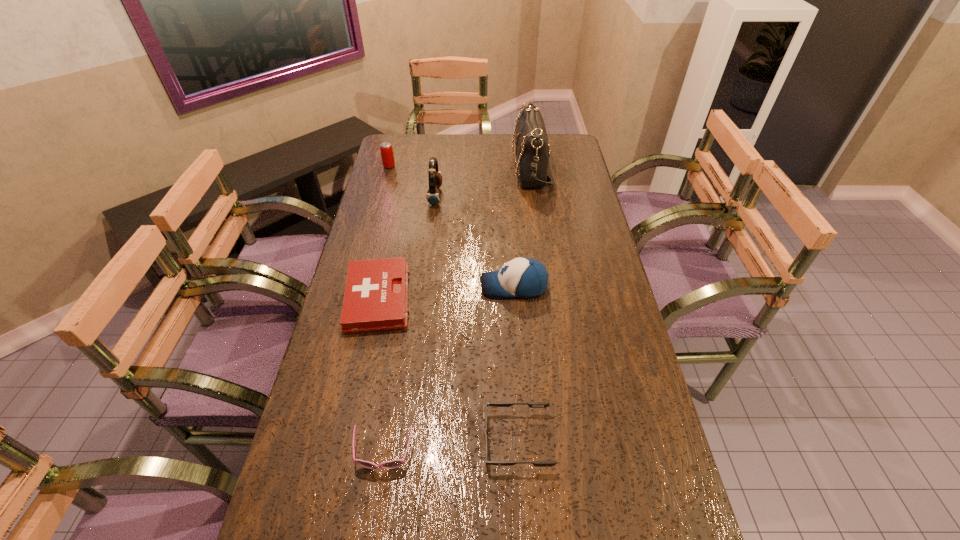
Where is `handbag that is at the far edge`? Image resolution: width=960 pixels, height=540 pixels. handbag that is at the far edge is located at coordinates coord(532,151).

I want to click on beer can that is at the far edge, so click(386, 149).

In order to click on beer can located at the left edge in this screenshot , I will do `click(386, 149)`.

The image size is (960, 540). In order to click on the first-aid kit present at the left edge in this screenshot , I will do `click(376, 293)`.

Where is `sunglasses present at the left edge`? Image resolution: width=960 pixels, height=540 pixels. sunglasses present at the left edge is located at coordinates (396, 463).

This screenshot has width=960, height=540. I want to click on object present at the right edge, so click(x=532, y=151).

The image size is (960, 540). Identify the location of object located in the far left corner section of the desktop. (386, 149).

You are a GUI agent. You are given a task and a screenshot of the screen. Output one action in this format:
    pyautogui.click(x=<x>, y=<y>)
    Task: Click on the object present at the far right corner
    This screenshot has width=960, height=540.
    Given the screenshot: What is the action you would take?
    pyautogui.click(x=532, y=151)

In the image, there is a desktop. Where is `blank space at the far edge`? The height and width of the screenshot is (540, 960). blank space at the far edge is located at coordinates (511, 137).

Locate an element on the screen. The image size is (960, 540). vacant position at the left edge of the desktop is located at coordinates (349, 514).